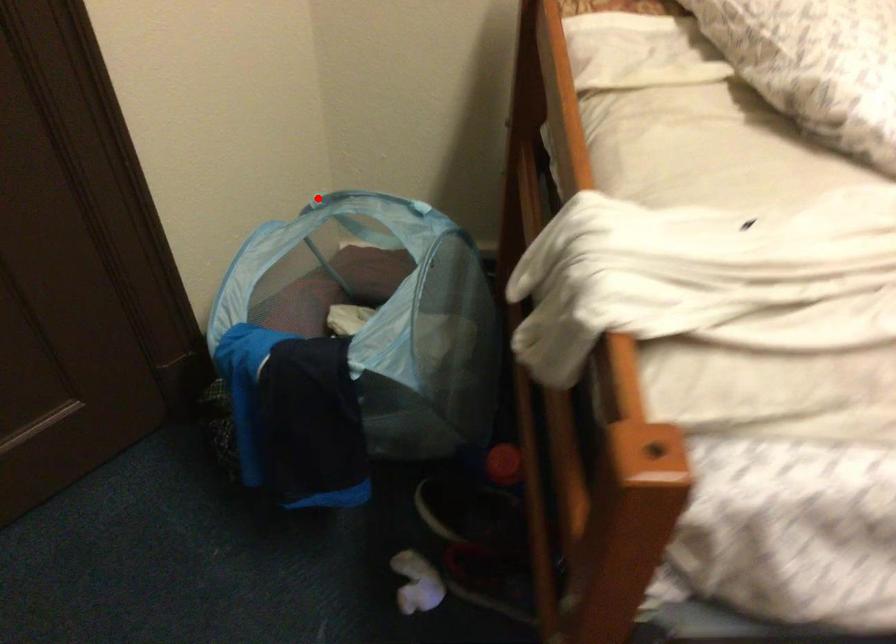
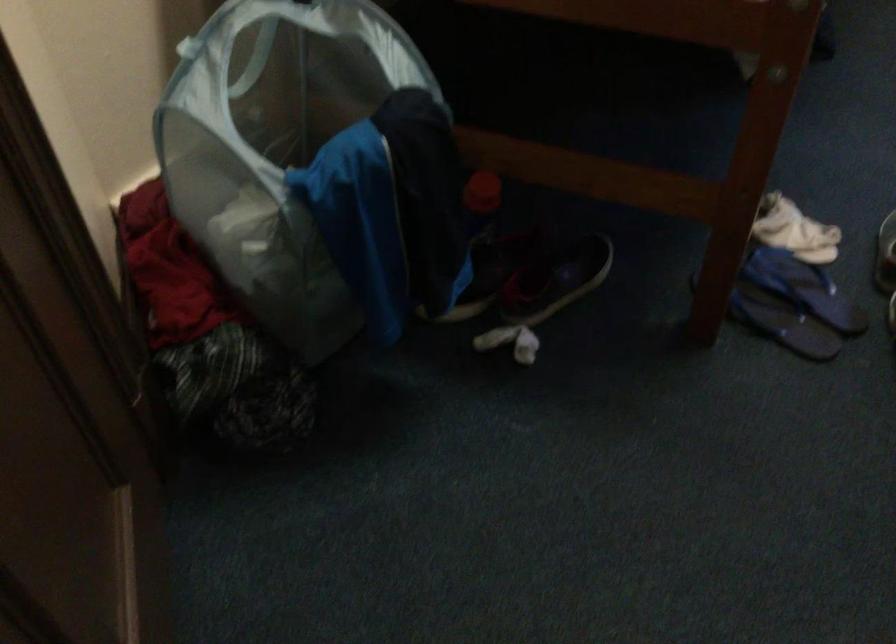
Question: I am providing you with two images of the same scene from different viewpoints. A red point is shown in image1. For the corresponding object point in image2, is it positioned nearer or farther from the camera?

Choices:
 (A) Nearer
 (B) Farther

Answer: (A)